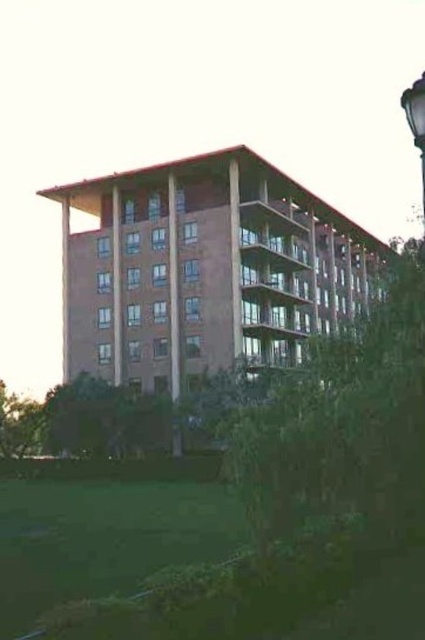
You are standing on the sidewalk in front of the brown brick building at center and notice the black metal street light at upper right. Which object is taller?

The black metal street light at upper right is taller than the brown brick building at center.

You are standing in front of a modern building and notice a brown brick building at center and a black metal street light at upper right. Which object takes up more area in the image?

The black metal street light at upper right takes up more area in the image than the brown brick building at center because the brown brick building at center occupies less space than black metal street light at upper right.